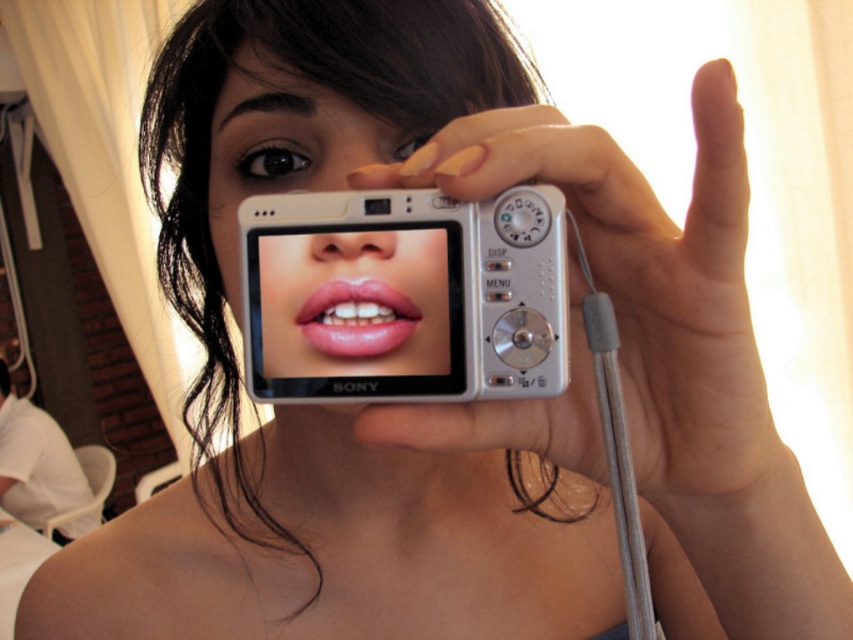
You are a photographer analyzing the composition of the image. The silver metallic camera at center is represented by point (645, 280). Where is the silver metallic camera at center located in the image coordinate system?

The silver metallic camera at center is located at point (645, 280) in the image coordinate system.

Based on the photo, you are a photographer setting up two cameras for a portrait shoot. You have a silver metallic camera at center and a white plastic camera at center. Which camera is placed lower in the setup?

The silver metallic camera at center is positioned under the white plastic camera at center, so it is placed lower in the setup.

You are a photographer trying to choose between the silver metallic camera at center and the white plastic camera at center for a portrait shoot. Based on their sizes, which camera might be more suitable for capturing a closeup shot of a person?

The silver metallic camera at center is much taller than the white plastic camera at center, so it might be more suitable for capturing a closeup shot due to its larger size providing better control and stability.